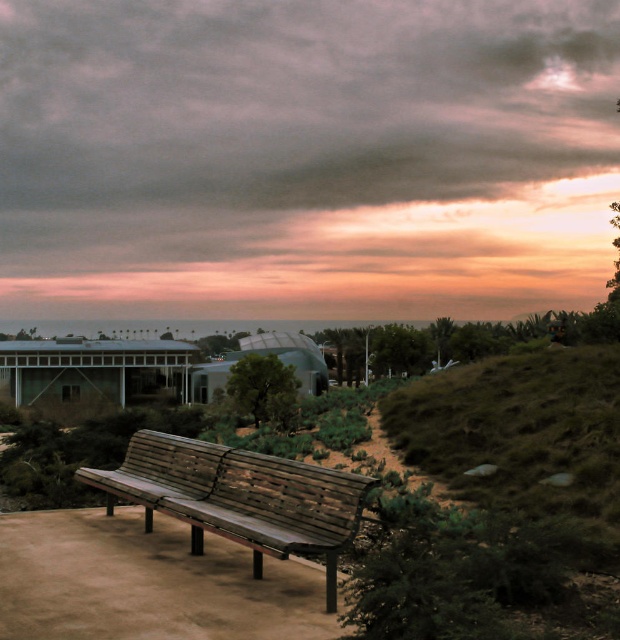
Between cloudy sky at upper center and wooden bench at center, which one has less height?

With less height is wooden bench at center.

Which is above, cloudy sky at upper center or wooden bench at center?

cloudy sky at upper center is higher up.

You are a GUI agent. You are given a task and a screenshot of the screen. Output one action in this format:
    pyautogui.click(x=<x>, y=<y>)
    Task: Click on the cloudy sky at upper center
    The width and height of the screenshot is (620, 640).
    Given the screenshot: What is the action you would take?
    pyautogui.click(x=298, y=131)